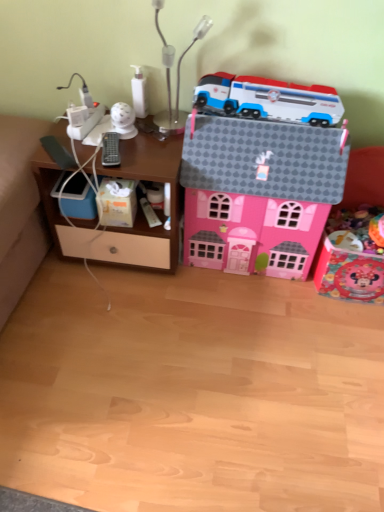
Question: Should I look upward or downward to see white glossy security camera at upper center, which is counted as the first toy, starting from the left?

Choices:
 (A) down
 (B) up

Answer: (B)

Question: Does white plastic container at lower center, the 3th toy when ordered from left to right, have a larger size compared to white glossy security camera at upper center, the sixth toy positioned from the right?

Choices:
 (A) no
 (B) yes

Answer: (A)

Question: From a real-world perspective, is white plastic container at lower center, the 3th toy when ordered from left to right, over white glossy security camera at upper center, which is counted as the first toy, starting from the left?

Choices:
 (A) yes
 (B) no

Answer: (B)

Question: From a real-world perspective, is white plastic container at lower center, the 3th toy when ordered from left to right, located beneath white glossy security camera at upper center, the sixth toy positioned from the right?

Choices:
 (A) no
 (B) yes

Answer: (B)

Question: Is white plastic container at lower center, the 3th toy when ordered from left to right, next to white glossy security camera at upper center, which is counted as the first toy, starting from the left, and touching it?

Choices:
 (A) no
 (B) yes

Answer: (A)

Question: Would you consider white plastic container at lower center, the 3th toy when ordered from left to right, to be distant from white glossy security camera at upper center, the sixth toy positioned from the right?

Choices:
 (A) yes
 (B) no

Answer: (B)

Question: Is white plastic container at lower center, the fourth toy positioned from the right, aimed at white glossy security camera at upper center, the sixth toy positioned from the right?

Choices:
 (A) no
 (B) yes

Answer: (A)

Question: Is white matte tissue box at lower left located within shiny pink toy house at right, which is the 1th toy from right to left?

Choices:
 (A) no
 (B) yes

Answer: (A)

Question: Does shiny pink toy house at right, which is the 1th toy from right to left, appear on the left side of white matte tissue box at lower left?

Choices:
 (A) yes
 (B) no

Answer: (B)

Question: Is shiny pink toy house at right, which is the 1th toy from right to left, closer to the viewer compared to white matte tissue box at lower left?

Choices:
 (A) yes
 (B) no

Answer: (A)

Question: Is shiny pink toy house at right, which is the 1th toy from right to left, further to the viewer compared to white matte tissue box at lower left?

Choices:
 (A) no
 (B) yes

Answer: (A)

Question: From the image's perspective, is shiny pink toy house at right, which is the 1th toy from right to left, beneath white matte tissue box at lower left?

Choices:
 (A) no
 (B) yes

Answer: (B)

Question: From a real-world perspective, is shiny pink toy house at right, which is the 1th toy from right to left, physically above white matte tissue box at lower left?

Choices:
 (A) no
 (B) yes

Answer: (A)

Question: Are white glossy bottle at upper center, positioned as the 5th toy in right-to-left order, and white plastic train at upper center, arranged as the fourth toy when viewed from the left, making contact?

Choices:
 (A) yes
 (B) no

Answer: (B)